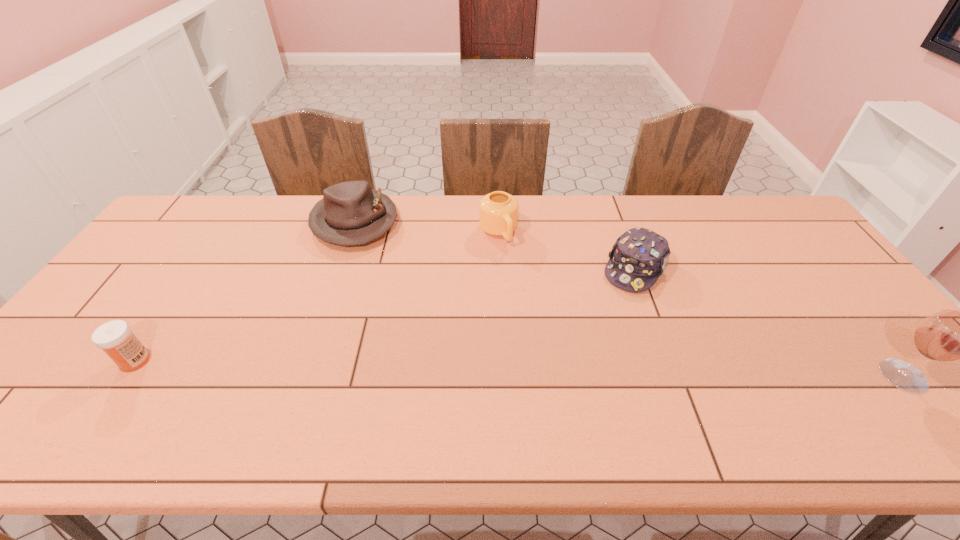
You are a GUI agent. You are given a task and a screenshot of the screen. Output one action in this format:
    pyautogui.click(x=<x>, y=<y>)
    Task: Click on the vacant point located between the fourth object from right to left and the wineglass
    Image resolution: width=960 pixels, height=540 pixels.
    Given the screenshot: What is the action you would take?
    pyautogui.click(x=629, y=299)

At what (x,y) coordinates should I click in order to perform the action: click on empty space between the second object from left to right and the medicine. Please return your answer as a coordinate pair (x, y). The image size is (960, 540). Looking at the image, I should click on (245, 291).

Locate an element on the screen. vacant space that's between the third object from left to right and the medicine is located at coordinates (317, 296).

This screenshot has width=960, height=540. Identify the location of free area in between the headwear and the wineglass. (768, 322).

You are a GUI agent. You are given a task and a screenshot of the screen. Output one action in this format:
    pyautogui.click(x=<x>, y=<y>)
    Task: Click on the unoccupied position between the leftmost object and the hat
    Image resolution: width=960 pixels, height=540 pixels.
    Given the screenshot: What is the action you would take?
    pyautogui.click(x=245, y=291)

Where is `free area in between the hat and the tallest object`? free area in between the hat and the tallest object is located at coordinates (629, 299).

The image size is (960, 540). I want to click on empty space between the leftmost object and the third object from right to left, so click(317, 296).

Image resolution: width=960 pixels, height=540 pixels. What are the coordinates of `vacant point located between the leftmost object and the hat` in the screenshot? It's located at (245, 291).

I want to click on object that is the third closest to the headwear, so click(351, 213).

Locate an element on the screen. The image size is (960, 540). object that is the closest to the mug is located at coordinates (638, 258).